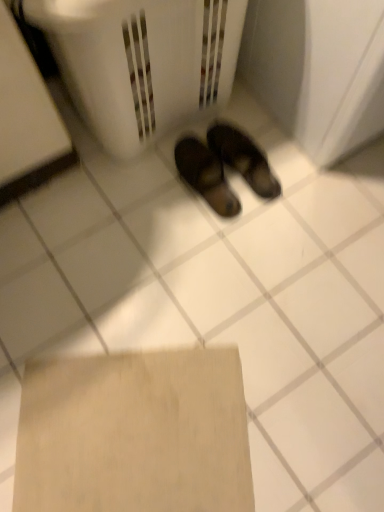
Question: Is white plastic laundry basket at center shorter than beige cardboard at lower center?

Choices:
 (A) no
 (B) yes

Answer: (A)

Question: Is white plastic laundry basket at center at the left side of beige cardboard at lower center?

Choices:
 (A) no
 (B) yes

Answer: (A)

Question: Can you confirm if white plastic laundry basket at center is bigger than beige cardboard at lower center?

Choices:
 (A) yes
 (B) no

Answer: (A)

Question: From the image's perspective, is white plastic laundry basket at center over beige cardboard at lower center?

Choices:
 (A) no
 (B) yes

Answer: (B)

Question: Is white plastic laundry basket at center completely or partially outside of beige cardboard at lower center?

Choices:
 (A) no
 (B) yes

Answer: (B)

Question: Based on their positions, is white plastic laundry basket at center located to the left or right of beige cardboard at lower center?

Choices:
 (A) right
 (B) left

Answer: (A)

Question: Does point (160, 112) appear closer or farther from the camera than point (127, 380)?

Choices:
 (A) closer
 (B) farther

Answer: (B)

Question: From the image's perspective, relative to beige cardboard at lower center, is white plastic laundry basket at center above or below?

Choices:
 (A) above
 (B) below

Answer: (A)

Question: In terms of height, does white plastic laundry basket at center look taller or shorter compared to beige cardboard at lower center?

Choices:
 (A) tall
 (B) short

Answer: (A)

Question: In the image, is white plastic laundry basket at center positioned in front of or behind brown leather sandals at center?

Choices:
 (A) front
 (B) behind

Answer: (A)

Question: In terms of width, does white plastic laundry basket at center look wider or thinner when compared to brown leather sandals at center?

Choices:
 (A) wide
 (B) thin

Answer: (A)

Question: Is white plastic laundry basket at center to the left or to the right of brown leather sandals at center in the image?

Choices:
 (A) left
 (B) right

Answer: (A)

Question: From their relative heights in the image, would you say white plastic laundry basket at center is taller or shorter than brown leather sandals at center?

Choices:
 (A) tall
 (B) short

Answer: (A)

Question: Do you think brown leather sandals at center is within white plastic laundry basket at center, or outside of it?

Choices:
 (A) inside
 (B) outside

Answer: (B)

Question: From a real-world perspective, is brown leather sandals at center above or below white plastic laundry basket at center?

Choices:
 (A) above
 (B) below

Answer: (B)